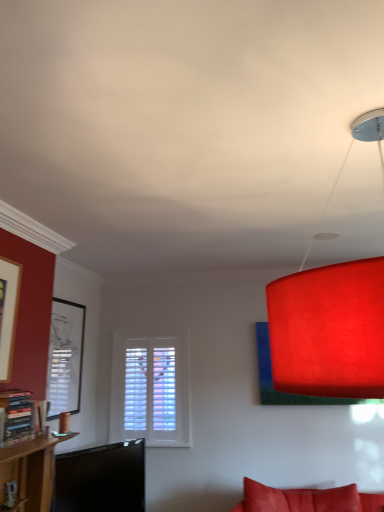
Where is `matte red lampshade at upper right`? The image size is (384, 512). matte red lampshade at upper right is located at coordinates (329, 330).

In the scene shown: What is the approximate width of matte black picture frame at left?

matte black picture frame at left is 1.94 inches wide.

The image size is (384, 512). What do you see at coordinates (65, 358) in the screenshot?
I see `matte black picture frame at left` at bounding box center [65, 358].

This screenshot has width=384, height=512. I want to click on matte red lampshade at upper right, so click(x=329, y=330).

Are matte red lampshade at upper right and wooden bookshelf at left located far from each other?

Absolutely, matte red lampshade at upper right is distant from wooden bookshelf at left.

Does matte red lampshade at upper right have a lesser width compared to wooden bookshelf at left?

No.

Considering the relative positions of matte red lampshade at upper right and wooden bookshelf at left in the image provided, is matte red lampshade at upper right to the left or to the right of wooden bookshelf at left?

In the image, matte red lampshade at upper right appears on the right side of wooden bookshelf at left.

Is matte red lampshade at upper right looking in the opposite direction of wooden bookshelf at left?

matte red lampshade at upper right does not have its back to wooden bookshelf at left.

Consider the image. Is matte black picture frame at left in front of or behind wooden bookshelf at left in the image?

Clearly, matte black picture frame at left is behind wooden bookshelf at left.

Can you confirm if matte black picture frame at left is wider than wooden bookshelf at left?

No, matte black picture frame at left is not wider than wooden bookshelf at left.

From a real-world perspective, is matte black picture frame at left physically above wooden bookshelf at left?

Correct, in the physical world, matte black picture frame at left is higher than wooden bookshelf at left.

Which is behind, point (60, 364) or point (1, 434)?

The point (60, 364) is farther from the camera.

Does matte black picture frame at left have a greater height compared to matte red lampshade at upper right?

Yes.

Find the location of a particular element. picture frame behind the matte red lampshade at upper right is located at coordinates (65, 358).

From a real-world perspective, is matte black picture frame at left above or below matte red lampshade at upper right?

In terms of real-world spatial position, matte black picture frame at left is below matte red lampshade at upper right.

Does matte black picture frame at left touch matte red lampshade at upper right?

No, matte black picture frame at left is not in contact with matte red lampshade at upper right.

Between wooden bookshelf at left and matte black picture frame at left, which one has smaller width?

With smaller width is matte black picture frame at left.

Is wooden bookshelf at left oriented towards matte black picture frame at left?

No, wooden bookshelf at left is not oriented towards matte black picture frame at left.

You are a GUI agent. You are given a task and a screenshot of the screen. Output one action in this format:
    pyautogui.click(x=<x>, y=<y>)
    Task: Click on the picture frame on the left of wooden bookshelf at left
    
    Given the screenshot: What is the action you would take?
    pyautogui.click(x=65, y=358)

From their relative heights in the image, would you say wooden bookshelf at left is taller or shorter than matte black picture frame at left?

Clearly, wooden bookshelf at left is shorter compared to matte black picture frame at left.

Is wooden bookshelf at left positioned with its back to matte red lampshade at upper right?

No, wooden bookshelf at left is not facing away from matte red lampshade at upper right.

Does wooden bookshelf at left have a greater width compared to matte red lampshade at upper right?

No, wooden bookshelf at left is not wider than matte red lampshade at upper right.

This screenshot has width=384, height=512. I want to click on shelf below the matte red lampshade at upper right (from the image's perspective), so click(x=15, y=415).

What's the angular difference between wooden bookshelf at left and matte red lampshade at upper right's facing directions?

179 degrees separate the facing orientations of wooden bookshelf at left and matte red lampshade at upper right.

From a real-world perspective, is matte red lampshade at upper right on top of matte black picture frame at left?

Yes, from a real-world perspective, matte red lampshade at upper right is on top of matte black picture frame at left.

Is matte red lampshade at upper right located outside matte black picture frame at left?

Yes, matte red lampshade at upper right is outside of matte black picture frame at left.

Between matte red lampshade at upper right and matte black picture frame at left, which one appears on the left side from the viewer's perspective?

From the viewer's perspective, matte black picture frame at left appears more on the left side.

Locate an element on the screen. This screenshot has width=384, height=512. lamp lying on the right of wooden bookshelf at left is located at coordinates (329, 330).

Where is `shelf located above the matte black picture frame at left (from the image's perspective)`? This screenshot has height=512, width=384. shelf located above the matte black picture frame at left (from the image's perspective) is located at coordinates (15, 415).

Looking at the image, which one is located closer to wooden bookshelf at left, matte black picture frame at left or matte red lampshade at upper right?

Among the two, matte black picture frame at left is located nearer to wooden bookshelf at left.

Based on the photo, based on their spatial positions, is matte black picture frame at left or wooden bookshelf at left further from matte red lampshade at upper right?

matte black picture frame at left lies further to matte red lampshade at upper right than the other object.

When comparing their distances from matte red lampshade at upper right, does wooden bookshelf at left or matte black picture frame at left seem closer?

Based on the image, wooden bookshelf at left appears to be nearer to matte red lampshade at upper right.

When comparing their distances from matte black picture frame at left, does matte red lampshade at upper right or wooden bookshelf at left seem further?

matte red lampshade at upper right is further to matte black picture frame at left.

From the picture: Which object lies nearer to the anchor point wooden bookshelf at left, matte red lampshade at upper right or matte black picture frame at left?

Based on the image, matte black picture frame at left appears to be nearer to wooden bookshelf at left.

From the image, which object appears to be nearer to matte black picture frame at left, wooden bookshelf at left or matte red lampshade at upper right?

Based on the image, wooden bookshelf at left appears to be nearer to matte black picture frame at left.

The height and width of the screenshot is (512, 384). I want to click on shelf located between matte red lampshade at upper right and matte black picture frame at left in the depth direction, so click(15, 415).